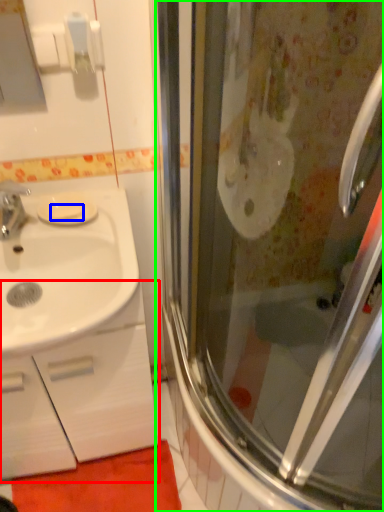
Question: Considering the real-world distances, which object is farthest from bathroom cabinet (highlighted by a red box)? soap (highlighted by a blue box) or screen door (highlighted by a green box)?

Choices:
 (A) soap
 (B) screen door

Answer: (A)